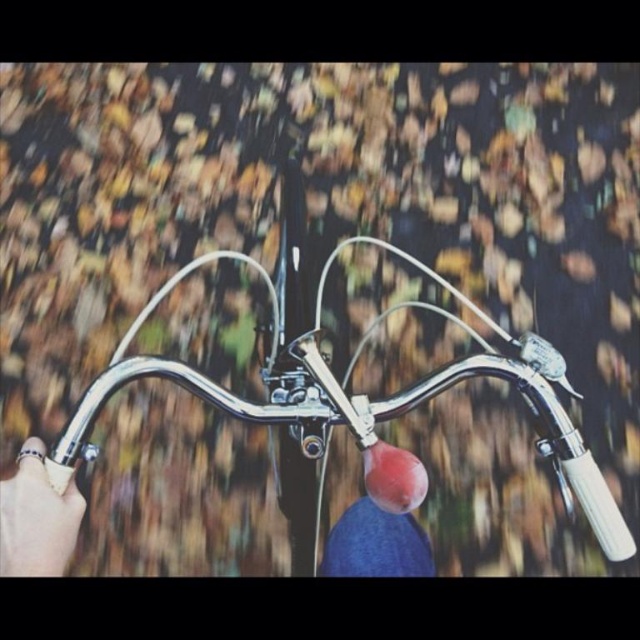
Question: Is polished chrome bicycle handlebars at center positioned behind gold metallic ring at lower left?

Choices:
 (A) yes
 (B) no

Answer: (A)

Question: From the image, what is the correct spatial relationship of polished chrome bicycle handlebars at center in relation to gold metallic ring at lower left?

Choices:
 (A) left
 (B) right

Answer: (B)

Question: Which point is closer to the camera taking this photo?

Choices:
 (A) (54, 502)
 (B) (544, 401)

Answer: (A)

Question: Which object appears farthest from the camera in this image?

Choices:
 (A) polished chrome bicycle handlebars at center
 (B) gold metallic ring at lower left

Answer: (A)

Question: Is the position of polished chrome bicycle handlebars at center more distant than that of gold metallic ring at lower left?

Choices:
 (A) no
 (B) yes

Answer: (B)

Question: Which of the following is the closest to the observer?

Choices:
 (A) polished chrome bicycle handlebars at center
 (B) gold metallic ring at lower left

Answer: (B)